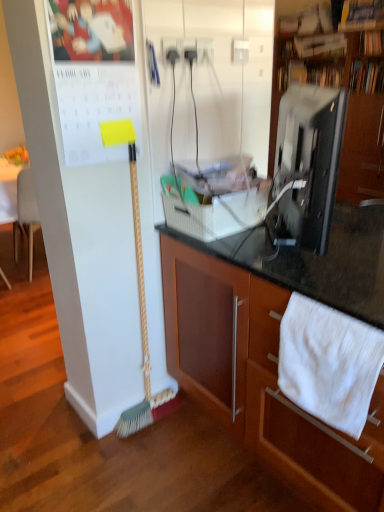
The width and height of the screenshot is (384, 512). What do you see at coordinates (362, 149) in the screenshot? I see `black glossy cabinet at upper right, positioned as the second cabinetry in bottom-to-top order` at bounding box center [362, 149].

Image resolution: width=384 pixels, height=512 pixels. What do you see at coordinates (277, 344) in the screenshot? I see `wooden cabinet at center, which is the 1th cabinetry from bottom to top` at bounding box center [277, 344].

You are a GUI agent. You are given a task and a screenshot of the screen. Output one action in this format:
    pyautogui.click(x=<x>, y=<y>)
    Task: Click on the green bristle broom at left
    Image resolution: width=384 pixels, height=512 pixels.
    Given the screenshot: What is the action you would take?
    pyautogui.click(x=141, y=329)

From a real-world perspective, is black glossy cabinet at upper right, which is the first cabinetry from back to front, physically above wooden cabinet at center, which is the 1th cabinetry from bottom to top?

Correct, in the physical world, black glossy cabinet at upper right, which is the first cabinetry from back to front, is higher than wooden cabinet at center, which is the 1th cabinetry from bottom to top.

What are the coordinates of `cabinetry in front of the black glossy cabinet at upper right, the 1th cabinetry when ordered from top to bottom` in the screenshot? It's located at (277, 344).

Can you confirm if black glossy cabinet at upper right, which is counted as the second cabinetry, starting from the front, is positioned to the right of wooden cabinet at center, the 2th cabinetry in the back-to-front sequence?

Yes, black glossy cabinet at upper right, which is counted as the second cabinetry, starting from the front, is to the right of wooden cabinet at center, the 2th cabinetry in the back-to-front sequence.

Who is bigger, black glossy cabinet at upper right, which is counted as the second cabinetry, starting from the front, or wooden cabinet at center, which is the 1th cabinetry from bottom to top?

black glossy cabinet at upper right, which is counted as the second cabinetry, starting from the front.

From their relative heights in the image, would you say black glossy cabinet at upper right, the 1th cabinetry when ordered from top to bottom, is taller or shorter than black glossy monitor at upper right?

In the image, black glossy cabinet at upper right, the 1th cabinetry when ordered from top to bottom, appears to be taller than black glossy monitor at upper right.

Could you measure the distance between black glossy cabinet at upper right, the 1th cabinetry when ordered from top to bottom, and black glossy monitor at upper right?

black glossy cabinet at upper right, the 1th cabinetry when ordered from top to bottom, is 3.23 meters from black glossy monitor at upper right.

Can you tell me how much black glossy cabinet at upper right, the 1th cabinetry when ordered from top to bottom, and black glossy monitor at upper right differ in facing direction?

There is a 137-degree angle between the facing directions of black glossy cabinet at upper right, the 1th cabinetry when ordered from top to bottom, and black glossy monitor at upper right.

From the image's perspective, is black glossy cabinet at upper right, the 1th cabinetry when ordered from top to bottom, located above or below black glossy monitor at upper right?

black glossy cabinet at upper right, the 1th cabinetry when ordered from top to bottom, is above black glossy monitor at upper right.

Is black glossy cabinet at upper right, which is counted as the second cabinetry, starting from the front, not close to white cotton towel at lower right?

Indeed, black glossy cabinet at upper right, which is counted as the second cabinetry, starting from the front, is not near white cotton towel at lower right.

From a real-world perspective, does black glossy cabinet at upper right, which is the first cabinetry from back to front, stand above white cotton towel at lower right?

Yes, from a real-world perspective, black glossy cabinet at upper right, which is the first cabinetry from back to front, is on top of white cotton towel at lower right.

Is black glossy cabinet at upper right, positioned as the second cabinetry in bottom-to-top order, to the right of white cotton towel at lower right from the viewer's perspective?

Correct, you'll find black glossy cabinet at upper right, positioned as the second cabinetry in bottom-to-top order, to the right of white cotton towel at lower right.

Between point (271, 125) and point (352, 409), which one is positioned behind?

Point (271, 125)

Based on the photo, could you tell me if green bristle broom at left is turned towards wooden cabinet at center, the 2th cabinetry in the back-to-front sequence?

No, green bristle broom at left is not turned towards wooden cabinet at center, the 2th cabinetry in the back-to-front sequence.

From a real-world perspective, does green bristle broom at left sit lower than wooden cabinet at center, which is the 1th cabinetry from bottom to top?

No, from a real-world perspective, green bristle broom at left is not below wooden cabinet at center, which is the 1th cabinetry from bottom to top.

The height and width of the screenshot is (512, 384). Identify the location of cabinetry below the white cotton towel at lower right (from the image's perspective). click(277, 344).

Is white cotton towel at lower right completely or partially inside wooden cabinet at center, the 2th cabinetry in the back-to-front sequence?

Yes, white cotton towel at lower right can be found within wooden cabinet at center, the 2th cabinetry in the back-to-front sequence.

From a real-world perspective, who is located higher, wooden cabinet at center, which is the 1th cabinetry from bottom to top, or white cotton towel at lower right?

From a 3D spatial view, white cotton towel at lower right is above.

Does point (289, 331) come behind point (144, 308)?

No.

Can you confirm if white cotton towel at lower right is wider than green bristle broom at left?

In fact, white cotton towel at lower right might be narrower than green bristle broom at left.

Locate an element on the screen. The image size is (384, 512). bath towel in front of the green bristle broom at left is located at coordinates (329, 362).

From a real-world perspective, is white cotton towel at lower right positioned above or below green bristle broom at left?

white cotton towel at lower right is above green bristle broom at left.

Considering the relative positions of wooden cabinet at center, which ranks as the 1th cabinetry in front-to-back order, and green bristle broom at left in the image provided, is wooden cabinet at center, which ranks as the 1th cabinetry in front-to-back order, to the left of green bristle broom at left from the viewer's perspective?

Incorrect, wooden cabinet at center, which ranks as the 1th cabinetry in front-to-back order, is not on the left side of green bristle broom at left.

Does wooden cabinet at center, which ranks as the 1th cabinetry in front-to-back order, contain green bristle broom at left?

That's incorrect, green bristle broom at left is not inside wooden cabinet at center, which ranks as the 1th cabinetry in front-to-back order.

Who is shorter, wooden cabinet at center, which ranks as the 1th cabinetry in front-to-back order, or green bristle broom at left?

wooden cabinet at center, which ranks as the 1th cabinetry in front-to-back order, is shorter.

From the image's perspective, which object appears higher, wooden cabinet at center, which is the 1th cabinetry from bottom to top, or green bristle broom at left?

green bristle broom at left appears higher in the image.

Where is `cabinetry that is behind the wooden cabinet at center, which is the 1th cabinetry from bottom to top`? This screenshot has height=512, width=384. cabinetry that is behind the wooden cabinet at center, which is the 1th cabinetry from bottom to top is located at coordinates (362, 149).

Locate an element on the screen. desktop computer on the left of black glossy cabinet at upper right, the 1th cabinetry when ordered from top to bottom is located at coordinates (309, 160).

Looking at the image, which one is located further to green bristle broom at left, black glossy cabinet at upper right, which is the first cabinetry from back to front, or white cotton towel at lower right?

black glossy cabinet at upper right, which is the first cabinetry from back to front, lies further to green bristle broom at left than the other object.

Based on their spatial positions, is wooden cabinet at center, acting as the second cabinetry starting from the top, or black glossy cabinet at upper right, which is the first cabinetry from back to front, further from black glossy monitor at upper right?

black glossy cabinet at upper right, which is the first cabinetry from back to front, lies further to black glossy monitor at upper right than the other object.

Based on their spatial positions, is white cotton towel at lower right or black glossy monitor at upper right closer to green bristle broom at left?

Based on the image, black glossy monitor at upper right appears to be nearer to green bristle broom at left.

Considering their positions, is black glossy cabinet at upper right, which is counted as the second cabinetry, starting from the front, positioned closer to wooden cabinet at center, the 2th cabinetry in the back-to-front sequence, than green bristle broom at left?

The object closer to wooden cabinet at center, the 2th cabinetry in the back-to-front sequence, is green bristle broom at left.

Based on their spatial positions, is white cotton towel at lower right or black glossy cabinet at upper right, which is counted as the second cabinetry, starting from the front, closer to green bristle broom at left?

white cotton towel at lower right lies closer to green bristle broom at left than the other object.

When comparing their distances from black glossy cabinet at upper right, positioned as the second cabinetry in bottom-to-top order, does white cotton towel at lower right or black glossy monitor at upper right seem further?

Among the two, white cotton towel at lower right is located further to black glossy cabinet at upper right, positioned as the second cabinetry in bottom-to-top order.

When comparing their distances from black glossy monitor at upper right, does white cotton towel at lower right or green bristle broom at left seem further?

green bristle broom at left is further to black glossy monitor at upper right.

Estimate the real-world distances between objects in this image. Which object is closer to black glossy monitor at upper right, black glossy cabinet at upper right, which is counted as the second cabinetry, starting from the front, or white cotton towel at lower right?

Among the two, white cotton towel at lower right is located nearer to black glossy monitor at upper right.

Where is `desktop computer between green bristle broom at left and wooden cabinet at center, which ranks as the 1th cabinetry in front-to-back order, in the horizontal direction`? This screenshot has height=512, width=384. desktop computer between green bristle broom at left and wooden cabinet at center, which ranks as the 1th cabinetry in front-to-back order, in the horizontal direction is located at coordinates (309, 160).

Find the location of a particular element. This screenshot has width=384, height=512. bath towel between green bristle broom at left and wooden cabinet at center, which ranks as the 1th cabinetry in front-to-back order, from left to right is located at coordinates (329, 362).

At what (x,y) coordinates should I click in order to perform the action: click on desktop computer between white cotton towel at lower right and black glossy cabinet at upper right, positioned as the second cabinetry in bottom-to-top order, from front to back. Please return your answer as a coordinate pair (x, y). The height and width of the screenshot is (512, 384). Looking at the image, I should click on (309, 160).

In order to click on brush located between black glossy monitor at upper right and black glossy cabinet at upper right, which is counted as the second cabinetry, starting from the front, in the depth direction in this screenshot , I will do `click(141, 329)`.